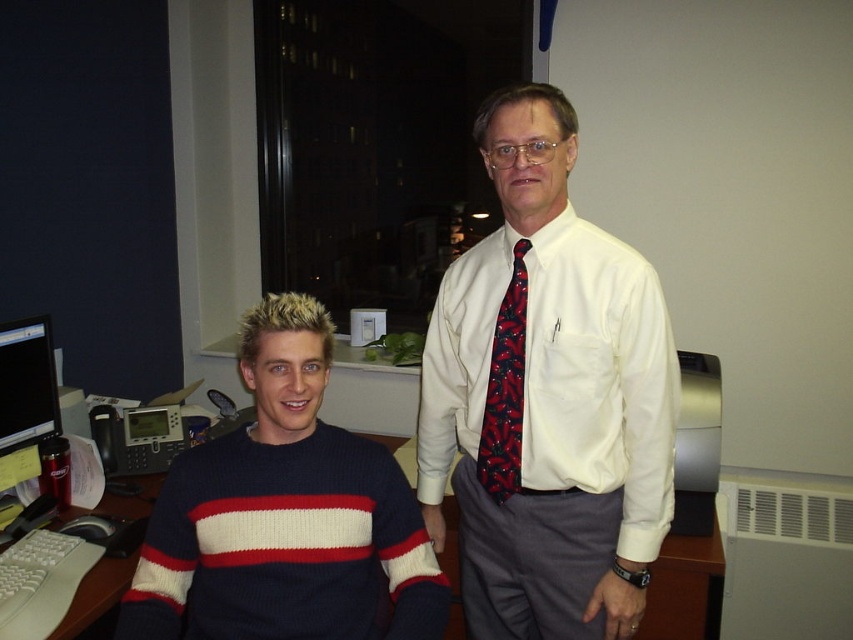
You are a tailor measuring clothing items in an office. You need to determine which item is taller between the white cotton dress shirt at center and the dark red textured tie at center. Which one is taller?

The white cotton dress shirt at center is taller than the dark red textured tie at center.

You are an interior designer assessing the office layout. You need to hang a picture frame that is 12 inches tall between the knit sweater at left and the dark red textured tie at center. Considering their heights, which object should the frame be placed closer to?

The knit sweater at left has a greater height compared to the dark red textured tie at center, so the picture frame should be placed closer to the dark red textured tie at center to maintain visual balance between the two objects.